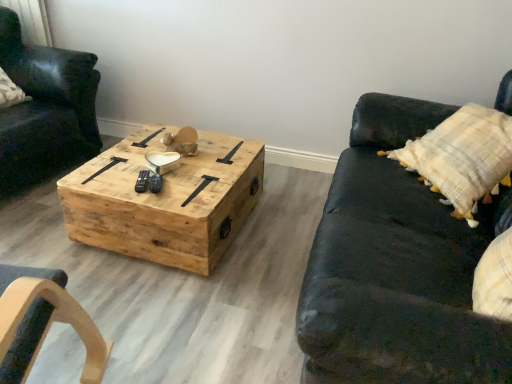
Question: Is matte black leather chair at left closer to the viewer compared to black leather couch at right?

Choices:
 (A) yes
 (B) no

Answer: (B)

Question: Is black leather couch at right completely or partially inside matte black leather chair at left?

Choices:
 (A) no
 (B) yes

Answer: (A)

Question: Can you see matte black leather chair at left touching black leather couch at right?

Choices:
 (A) yes
 (B) no

Answer: (B)

Question: Can you confirm if matte black leather chair at left is positioned to the right of black leather couch at right?

Choices:
 (A) yes
 (B) no

Answer: (B)

Question: From a real-world perspective, is matte black leather chair at left positioned under black leather couch at right based on gravity?

Choices:
 (A) yes
 (B) no

Answer: (B)

Question: From the image's perspective, is matte black leather chair at left above or below natural wood coffee table at center?

Choices:
 (A) below
 (B) above

Answer: (B)

Question: Is matte black leather chair at left inside the boundaries of natural wood coffee table at center, or outside?

Choices:
 (A) outside
 (B) inside

Answer: (A)

Question: In the image, is matte black leather chair at left positioned in front of or behind natural wood coffee table at center?

Choices:
 (A) behind
 (B) front

Answer: (A)

Question: Is point (18, 66) positioned closer to the camera than point (216, 198)?

Choices:
 (A) closer
 (B) farther

Answer: (B)

Question: Is black leather couch at right taller or shorter than matte black leather chair at left?

Choices:
 (A) short
 (B) tall

Answer: (A)

Question: Is point (437, 367) positioned closer to the camera than point (84, 100)?

Choices:
 (A) farther
 (B) closer

Answer: (B)

Question: Relative to matte black leather chair at left, is black leather couch at right in front or behind?

Choices:
 (A) front
 (B) behind

Answer: (A)

Question: From a real-world perspective, is black leather couch at right above or below matte black leather chair at left?

Choices:
 (A) below
 (B) above

Answer: (A)

Question: Looking at their shapes, would you say matte black leather chair at left is wider or thinner than black leather couch at right?

Choices:
 (A) thin
 (B) wide

Answer: (B)

Question: Considering the positions of matte black leather chair at left and black leather couch at right in the image, is matte black leather chair at left bigger or smaller than black leather couch at right?

Choices:
 (A) small
 (B) big

Answer: (A)